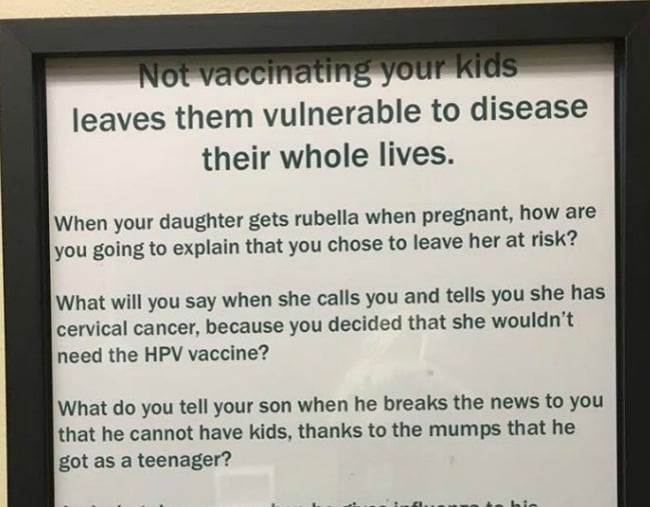
The width and height of the screenshot is (650, 507). I want to click on wall, so click(x=268, y=2).